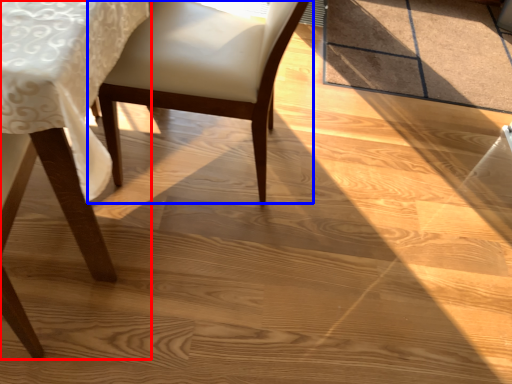
Question: Which of the following is the farthest to the observer, chair (highlighted by a red box) or chair (highlighted by a blue box)?

Choices:
 (A) chair
 (B) chair

Answer: (B)